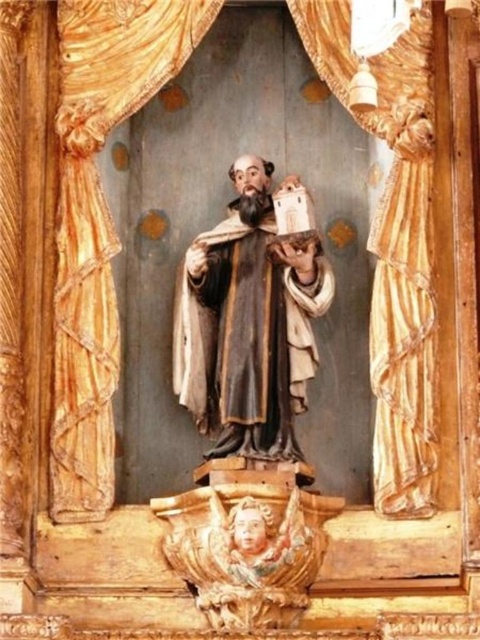
You are an interior designer assessing the space around the statue. The gold textured curtain at center and the matte brown robe at center are both in the same area. Which object takes up more visual space in the scene?

The gold textured curtain at center is bigger than the matte brown robe at center, so it takes up more visual space in the scene.

You are an architect designing a new chapel and need to ensure there is enough space between the central altar and the decorative cherub at the entrance. The minimum required distance is 8 meters. Based on the image, will the spacing between the matte brown robe at center and the carved wood cherub at lower center meet this requirement?

The distance between the matte brown robe at center and the carved wood cherub at lower center is 8.28 meters, which exceeds the minimum requirement of 8 meters. Therefore, the spacing meets the requirement.

You are an art conservator examining the statue. You notice a small point at coordinates point (247, 336). Based on the description, where is this point located on the statue?

The point (247, 336) is located on the matte brown robe at center.